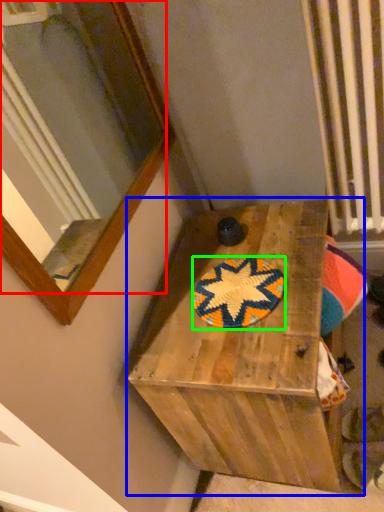
Question: Based on their relative distances, which object is nearer to mirror (highlighted by a red box)? Choose from furniture (highlighted by a blue box) and mat (highlighted by a green box).

Choices:
 (A) furniture
 (B) mat

Answer: (A)